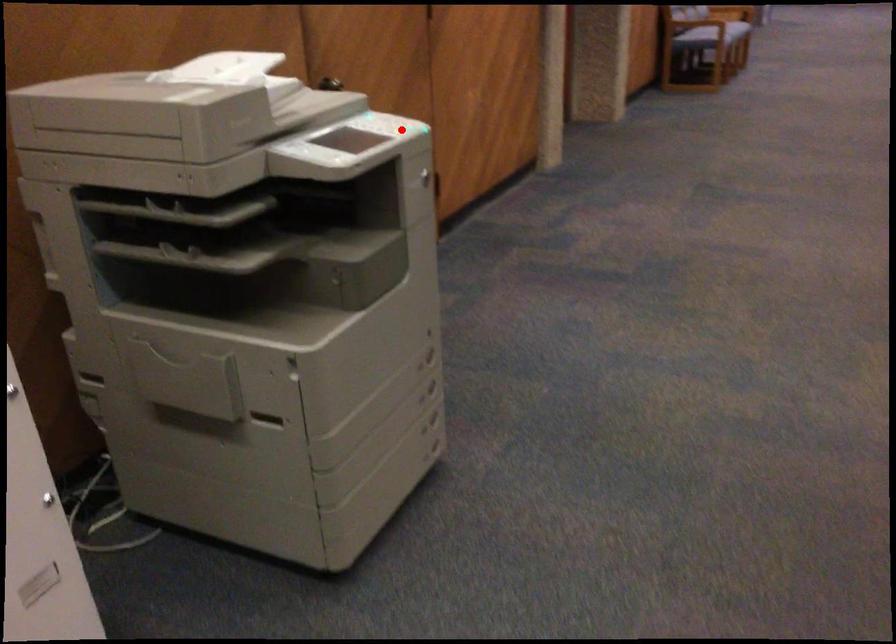
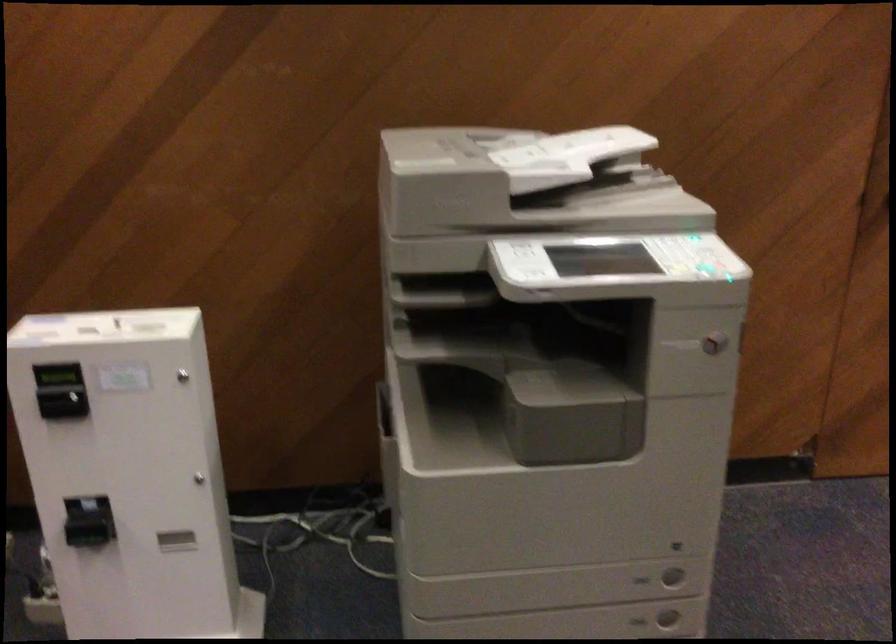
In the second image, find the point that corresponds to the highlighted location in the first image.

(698, 266)